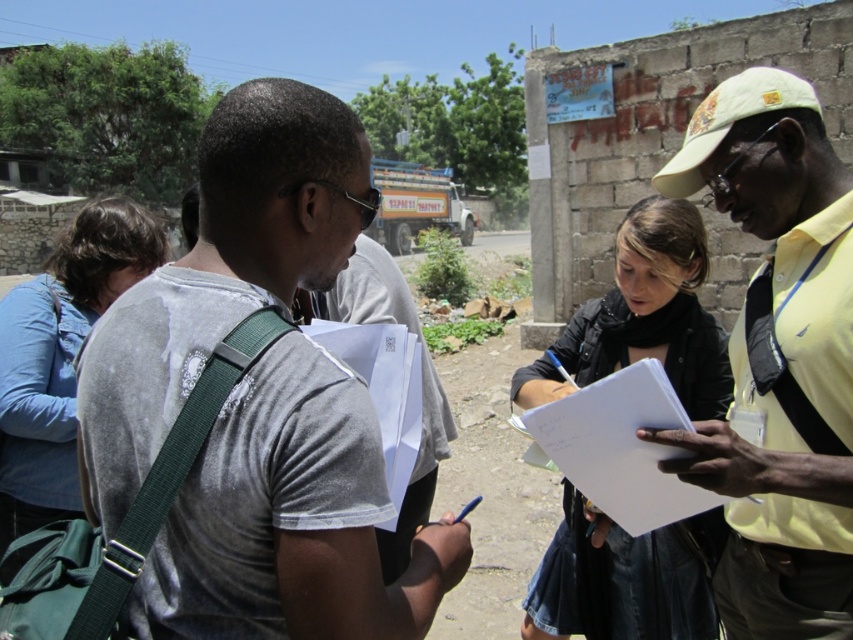
In the scene shown: You are standing in the scene and need to locate the black leather jacket at center. According to the coordinates provided, where exactly is it positioned?

The black leather jacket at center is located at point 0.486 along the horizontal axis and 0.768 along the vertical axis.

You are a photographer positioned to the left of the scene. You need to capture a photo that includes both the black leather jacket at center and the white paper clipboard at center. Which object should you position closer to the camera to ensure both fit in the frame?

Since the black leather jacket at center is wider than the white paper clipboard at center, you should position the black leather jacket at center closer to the camera to ensure both fit within the frame.

You are a photographer setting up a tripod between the black leather jacket at center and the blue denim jacket at left. Which jacket should you position the tripod closer to if you want to ensure it doesn

The black leather jacket at center might be wider than the blue denim jacket at left, so positioning the tripod closer to the black leather jacket at center would account for its potentially larger width to avoid obstruction.